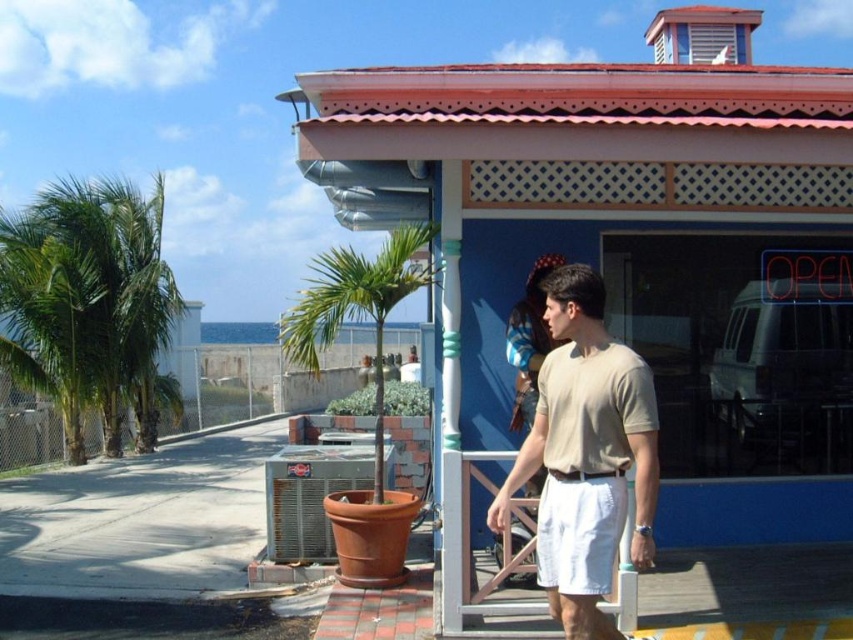
You are a photographer trying to capture a photo of the green leafy palm tree at center and the white cotton shorts at center from the front of the porch. Since you want to include both subjects in the frame, will the palm tree block the view of the shorts?

The green leafy palm tree at center is wider than the white cotton shorts at center, so the palm tree may block part of the shorts depending on their positions.

You are a customer trying to enter the building. The green leafy palm tree at center and the white cotton shorts at center are blocking your path. Which object is bigger and might be harder to move out of the way?

The green leafy palm tree at center is larger than the white cotton shorts at center, so it might be harder to move out of the way.